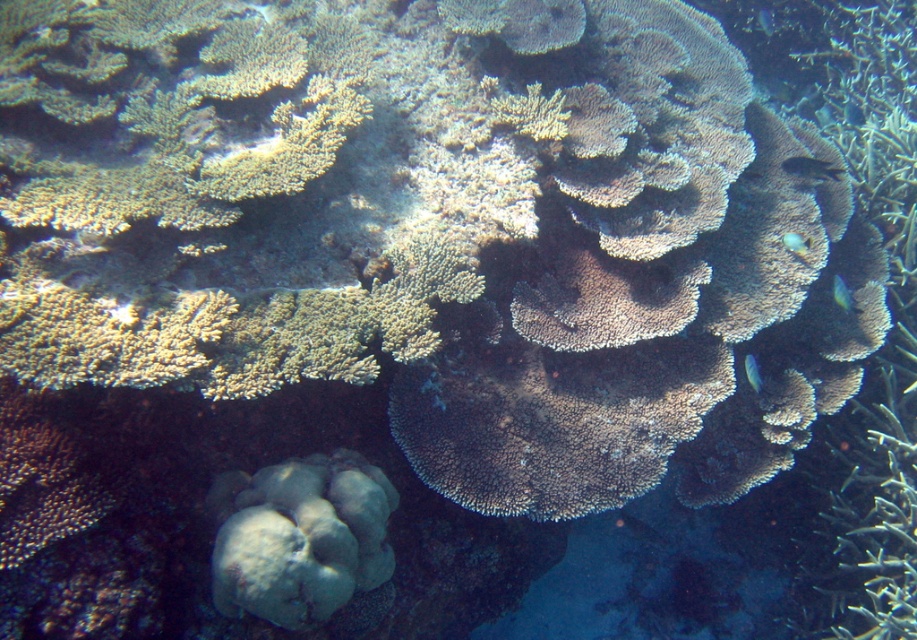
Question: Estimate the real-world distances between objects in this image. Which object is closer to the shiny black fish at center?

Choices:
 (A) blue glossy fish at right
 (B) translucent blue fish at lower right
 (C) translucent blue fish at upper center
 (D) blue glossy fish at lower right

Answer: (A)

Question: Which point is farther from the camera taking this photo?

Choices:
 (A) pos(750,355)
 (B) pos(836,172)
 (C) pos(836,294)

Answer: (B)

Question: Which is nearer to the blue glossy fish at right?

Choices:
 (A) shiny black fish at center
 (B) translucent blue fish at upper center
 (C) blue glossy fish at lower right
 (D) translucent blue fish at lower right

Answer: (D)

Question: Is blue glossy fish at right smaller than blue glossy fish at lower right?

Choices:
 (A) no
 (B) yes

Answer: (B)

Question: Can you confirm if blue glossy fish at lower right is bigger than translucent blue fish at upper center?

Choices:
 (A) yes
 (B) no

Answer: (A)

Question: Does translucent blue fish at lower right have a greater width compared to blue glossy fish at lower right?

Choices:
 (A) yes
 (B) no

Answer: (A)